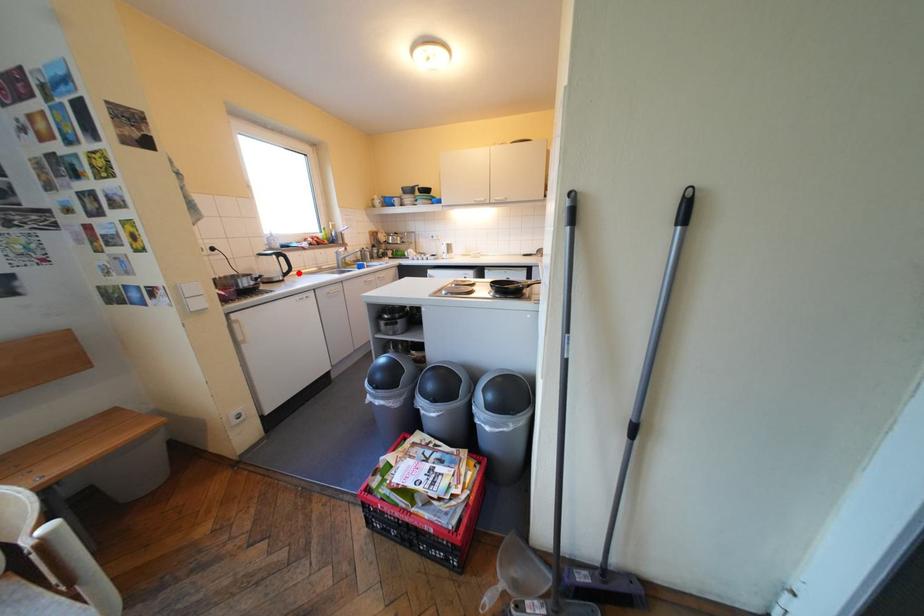
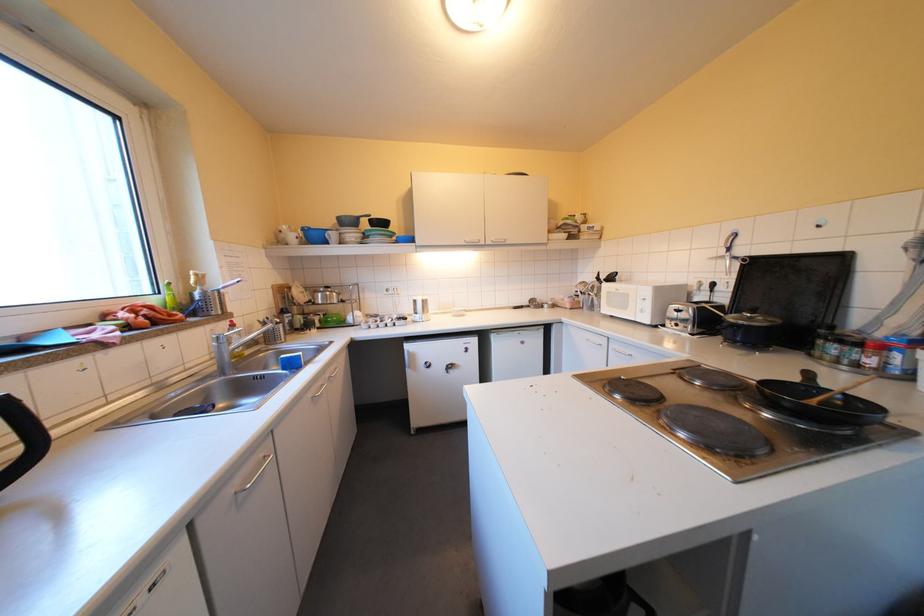
Find the pixel in the second image that matches the highlighted location in the first image.

(17, 479)